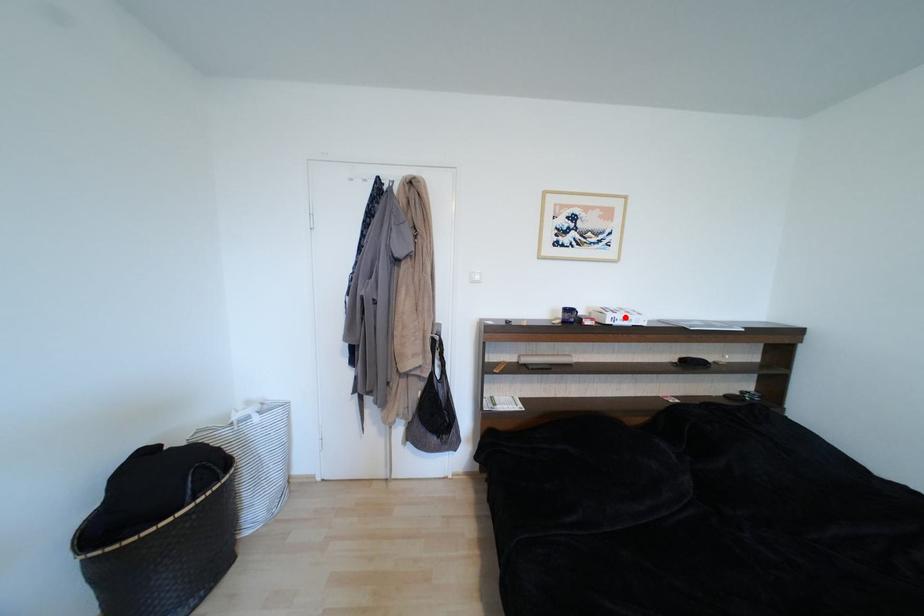
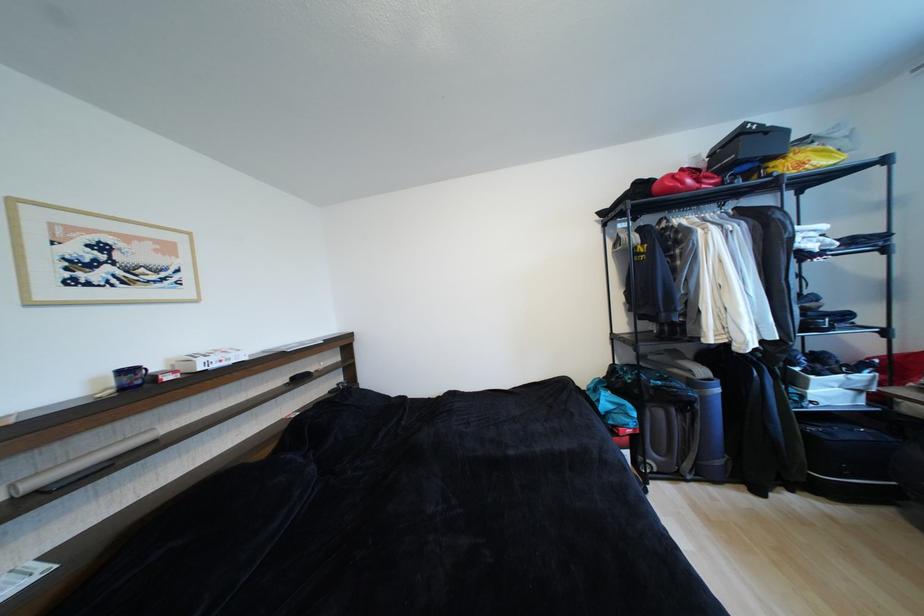
Find the pixel in the second image that matches the highlighted location in the first image.

(219, 360)